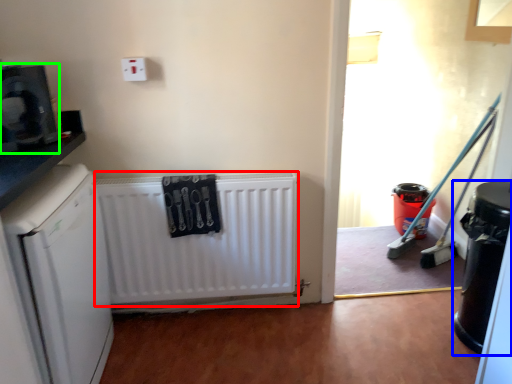
Question: Estimate the real-world distances between objects in this image. Which object is farther from radiator (highlighted by a red box), appliance (highlighted by a blue box) or appliance (highlighted by a green box)?

Choices:
 (A) appliance
 (B) appliance

Answer: (A)